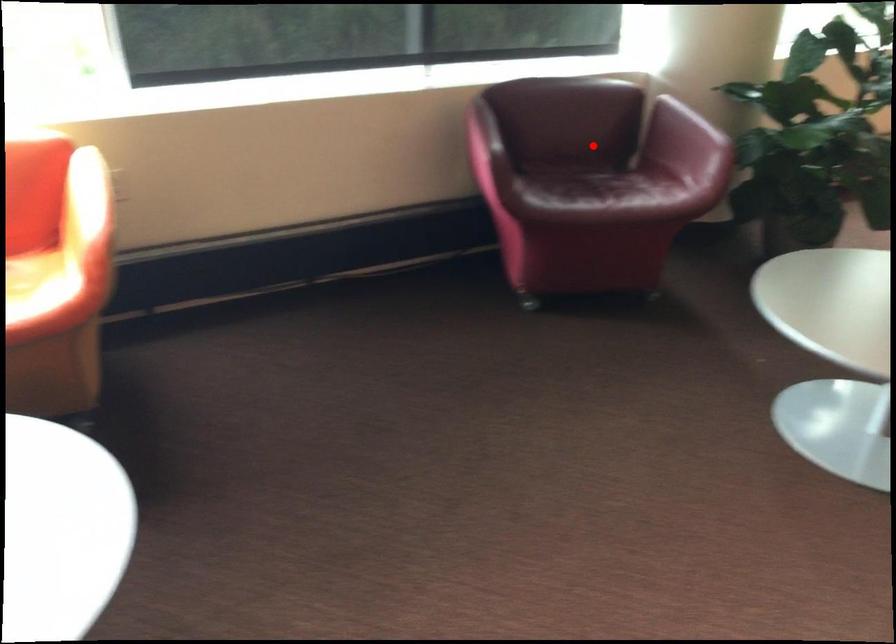
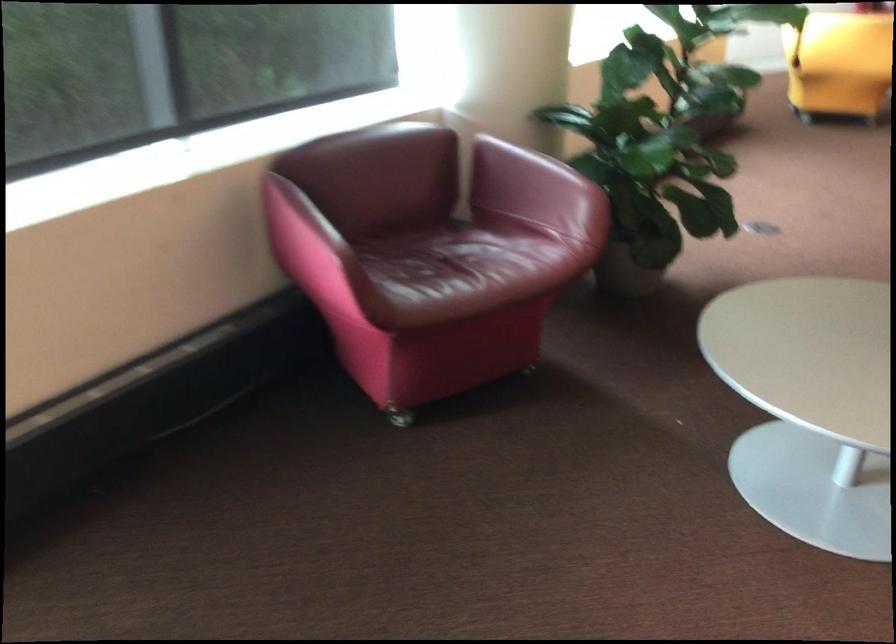
Locate, in the second image, the point that corresponds to the highlighted location in the first image.

(426, 212)